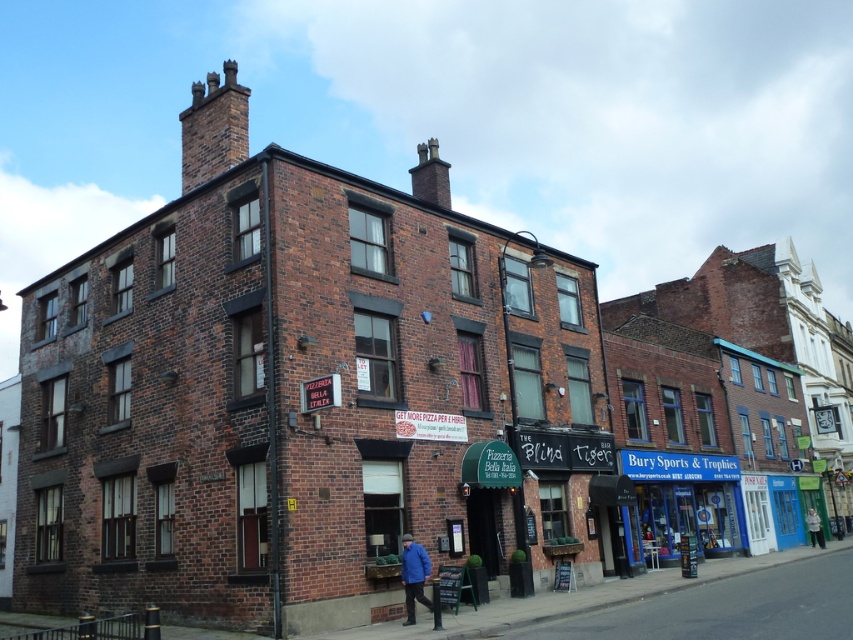
You are a customer looking for the entrance to the Pizzeria Bella Italia. You see a blue glass storefront at center and a blue fabric jacket at lower center. Which one is more likely to be the entrance to the pizzeria?

The blue glass storefront at center is more likely to be the entrance to the Pizzeria Bella Italia since it is larger in size compared to the blue fabric jacket at lower center, which is probably part of someone clothing.

You are a delivery person trying to hang a new sign on the wall between the blue fabric jacket at lower center and the light gray fabric jacket at lower right. The sign requires 1.2 meters of space. Can you fit it there?

The blue fabric jacket at lower center might be wider than light gray fabric jacket at lower right, so the available space between them may be less than 1.2 meters. It is uncertain if the sign will fit without further measurement.